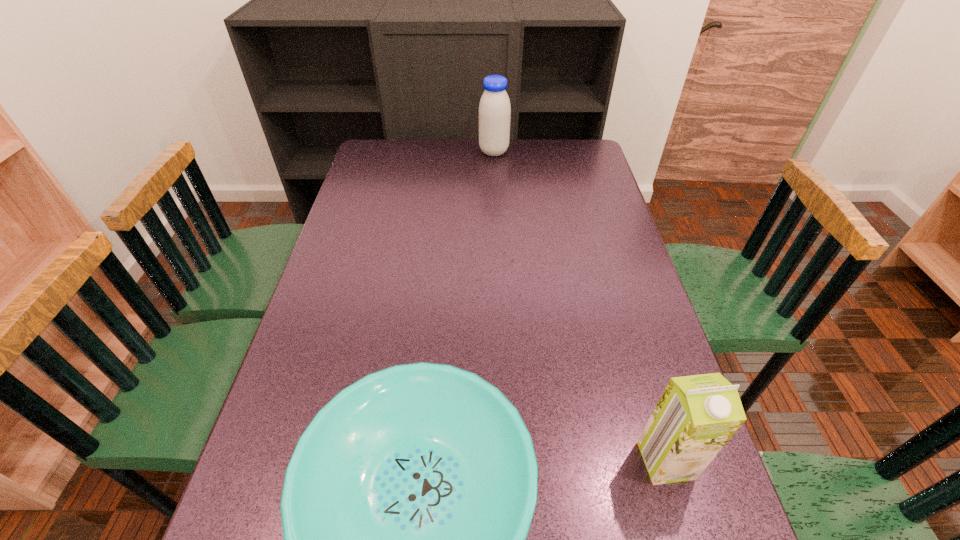
Where is `the left soya milk`? The image size is (960, 540). the left soya milk is located at coordinates (494, 109).

Locate an element on the screen. the farthest object is located at coordinates (494, 109).

Image resolution: width=960 pixels, height=540 pixels. Identify the location of the right soya milk. (696, 416).

I want to click on the rightmost object, so pos(696,416).

Identify the location of vacant space located 0.390m on the left of the left soya milk. (377, 152).

Identify the location of vacant space located on the back of the rightmost object. (644, 389).

At what (x,y) coordinates should I click in order to perform the action: click on object that is at the far edge. Please return your answer as a coordinate pair (x, y). The width and height of the screenshot is (960, 540). Looking at the image, I should click on (494, 109).

This screenshot has width=960, height=540. I want to click on object situated at the right edge, so click(x=696, y=416).

At what (x,y) coordinates should I click in order to perform the action: click on vacant space at the left edge of the desktop. Please return your answer as a coordinate pair (x, y). Image resolution: width=960 pixels, height=540 pixels. Looking at the image, I should click on (343, 270).

The width and height of the screenshot is (960, 540). I want to click on vacant point at the right edge, so click(603, 332).